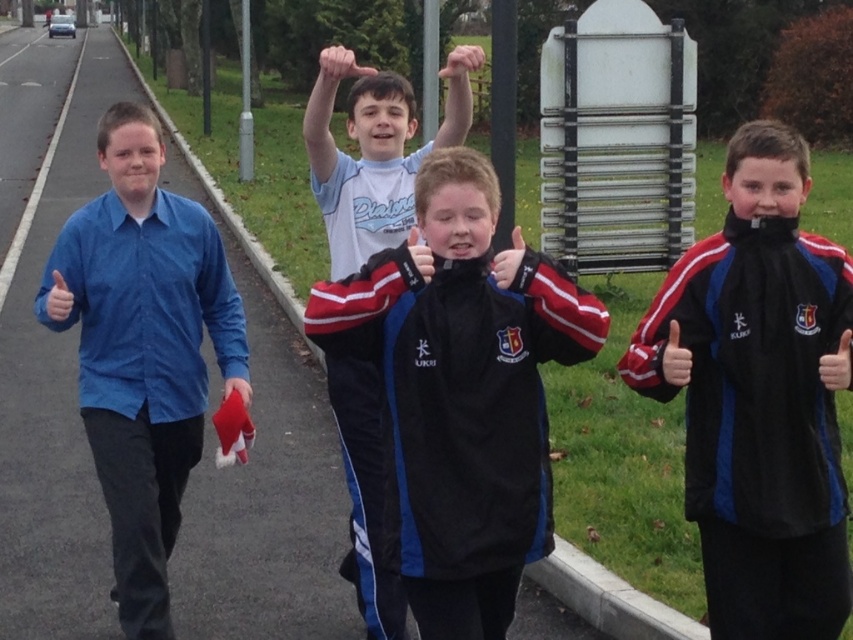
You are a photographer trying to capture the scene. You notice the blue cotton shirt at left and the smooth skin hand at upper center. Which object is closer to the bottom of the image?

The blue cotton shirt at left is positioned under the smooth skin hand at upper center, meaning it is closer to the bottom of the image.

You are a photographer trying to capture the boys in the park. You notice the velvet black jacket at center and the matte black hand at upper center. Which object would you need to adjust your camera focus to capture more detail, considering their sizes?

The velvet black jacket at center is thinner than the matte black hand at upper center, so you should focus on the matte black hand at upper center to capture more detail since it is larger.